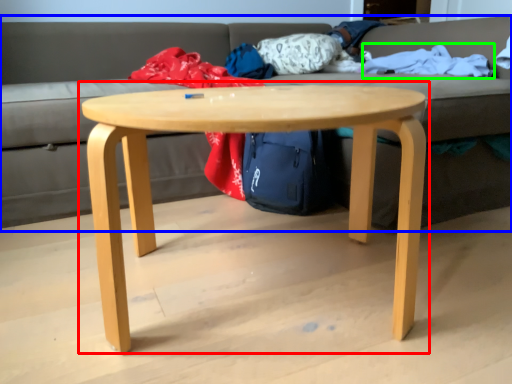
Question: Based on their relative distances, which object is nearer to coffee table (highlighted by a red box)? Choose from studio couch (highlighted by a blue box) and blanket (highlighted by a green box).

Choices:
 (A) studio couch
 (B) blanket

Answer: (B)